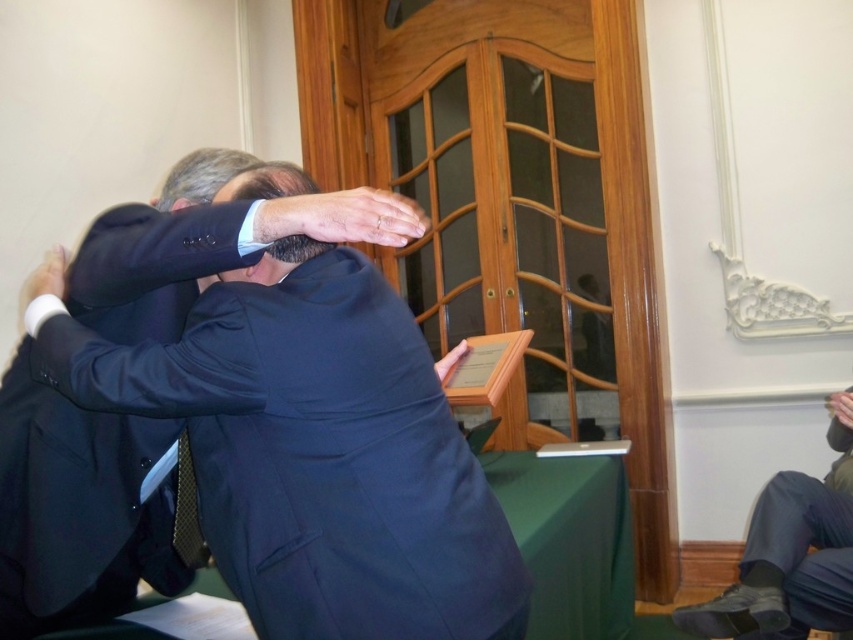
Question: Considering the relative positions of smooth dark hair at center and black textured tie at center in the image provided, where is smooth dark hair at center located with respect to black textured tie at center?

Choices:
 (A) right
 (B) left

Answer: (B)

Question: Is matte black suit at center to the right of smooth dark hair at center from the viewer's perspective?

Choices:
 (A) no
 (B) yes

Answer: (B)

Question: Which of the following is the closest to the observer?

Choices:
 (A) (196, 557)
 (B) (277, 378)
 (C) (212, 148)

Answer: (B)

Question: Based on their relative distances, which object is nearer to the matte black suit at center?

Choices:
 (A) smooth dark hair at center
 (B) black textured tie at center
 (C) matte black head at center

Answer: (C)

Question: Which object is the closest to the black textured tie at center?

Choices:
 (A) matte black suit at center
 (B) smooth dark hair at center
 (C) matte black head at center

Answer: (A)

Question: Is matte black head at center closer to the viewer compared to smooth dark hair at center?

Choices:
 (A) yes
 (B) no

Answer: (A)